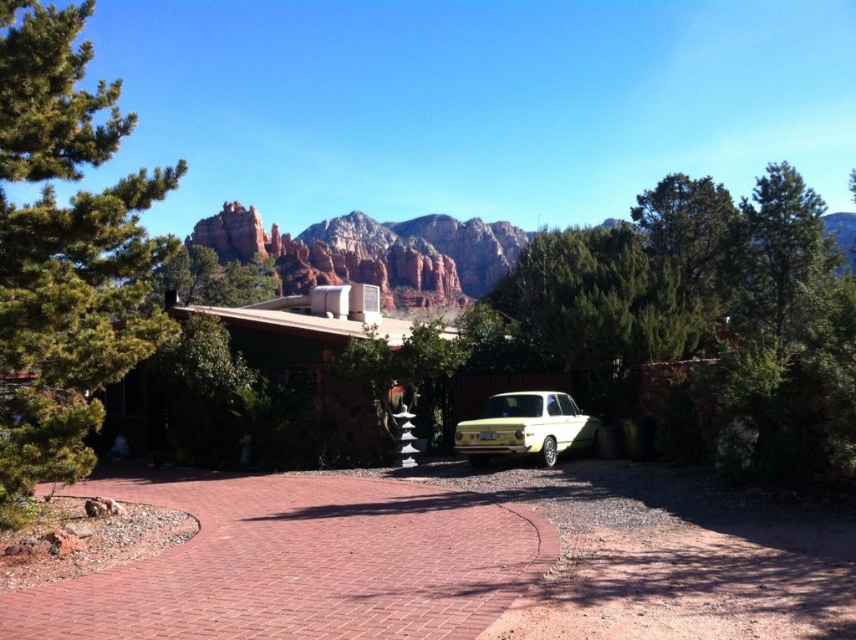
Can you confirm if green textured tree at upper right is positioned to the right of yellow matte car at center?

Correct, you'll find green textured tree at upper right to the right of yellow matte car at center.

Does point (764, 177) come closer to viewer compared to point (456, 428)?

No, it is not.

This screenshot has width=856, height=640. What are the coordinates of `green textured tree at upper right` in the screenshot? It's located at (777, 250).

Does point (363, 620) lie in front of point (770, 184)?

Yes.

What do you see at coordinates (301, 564) in the screenshot? I see `brick at center` at bounding box center [301, 564].

The width and height of the screenshot is (856, 640). Describe the element at coordinates (301, 564) in the screenshot. I see `brick at center` at that location.

Identify the location of brick at center. Image resolution: width=856 pixels, height=640 pixels. (301, 564).

From the picture: Can you confirm if green pine tree at left is positioned to the right of yellow matte car at center?

Incorrect, green pine tree at left is not on the right side of yellow matte car at center.

The image size is (856, 640). What do you see at coordinates (64, 250) in the screenshot?
I see `green pine tree at left` at bounding box center [64, 250].

Who is more distant from viewer, (13, 88) or (539, 445)?

The point (539, 445) is more distant.

What are the coordinates of `green pine tree at left` in the screenshot? It's located at (64, 250).